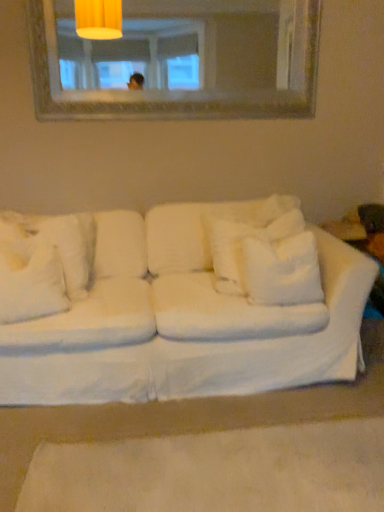
Question: Considering the relative sizes of white fabric couch at center and white fluffy pillow at center, the 2th pillow in the right-to-left sequence, in the image provided, is white fabric couch at center bigger than white fluffy pillow at center, the 2th pillow in the right-to-left sequence,?

Choices:
 (A) yes
 (B) no

Answer: (A)

Question: Considering the relative positions of white fabric couch at center and white fluffy pillow at center, the third pillow from the left, in the image provided, is white fabric couch at center in front of white fluffy pillow at center, the third pillow from the left,?

Choices:
 (A) no
 (B) yes

Answer: (B)

Question: Is white fabric couch at center aimed at white fluffy pillow at center, the third pillow from the left?

Choices:
 (A) yes
 (B) no

Answer: (A)

Question: Considering the relative sizes of white fabric couch at center and white fluffy pillow at center, the 2th pillow in the right-to-left sequence, in the image provided, is white fabric couch at center taller than white fluffy pillow at center, the 2th pillow in the right-to-left sequence,?

Choices:
 (A) yes
 (B) no

Answer: (A)

Question: Is white fabric couch at center completely or partially outside of white fluffy pillow at center, the 2th pillow in the right-to-left sequence?

Choices:
 (A) no
 (B) yes

Answer: (B)

Question: Is white fabric couch at center spatially inside white soft pillow at center, the fourth pillow in the left-to-right sequence, or outside of it?

Choices:
 (A) inside
 (B) outside

Answer: (B)

Question: Considering the positions of white fabric couch at center and white soft pillow at center, the fourth pillow in the left-to-right sequence, in the image, is white fabric couch at center taller or shorter than white soft pillow at center, the fourth pillow in the left-to-right sequence,?

Choices:
 (A) short
 (B) tall

Answer: (B)

Question: Is point (254, 331) closer or farther from the camera than point (253, 252)?

Choices:
 (A) closer
 (B) farther

Answer: (A)

Question: Considering their positions, is white fabric couch at center located in front of or behind white soft pillow at center, the fourth pillow in the left-to-right sequence?

Choices:
 (A) front
 (B) behind

Answer: (A)

Question: From the image's perspective, is white fluffy pillow at left, which ranks as the 3th pillow in right-to-left order, located above or below white soft pillow at center, arranged as the 1th pillow when viewed from the right?

Choices:
 (A) above
 (B) below

Answer: (B)

Question: Considering the positions of white fluffy pillow at left, the 2th pillow viewed from the left, and white soft pillow at center, arranged as the 1th pillow when viewed from the right, in the image, is white fluffy pillow at left, the 2th pillow viewed from the left, wider or thinner than white soft pillow at center, arranged as the 1th pillow when viewed from the right,?

Choices:
 (A) wide
 (B) thin

Answer: (A)

Question: Is white fluffy pillow at left, the 2th pillow viewed from the left, to the left or to the right of white soft pillow at center, the fourth pillow in the left-to-right sequence, in the image?

Choices:
 (A) left
 (B) right

Answer: (A)

Question: Does point (36, 251) appear closer or farther from the camera than point (261, 288)?

Choices:
 (A) farther
 (B) closer

Answer: (A)

Question: In the image, is white fluffy pillow at left, arranged as the first pillow when viewed from the left, positioned in front of or behind white fluffy pillow at center, the third pillow from the left?

Choices:
 (A) front
 (B) behind

Answer: (A)

Question: Looking at their shapes, would you say white fluffy pillow at left, arranged as the first pillow when viewed from the left, is wider or thinner than white fluffy pillow at center, the 2th pillow in the right-to-left sequence?

Choices:
 (A) thin
 (B) wide

Answer: (B)